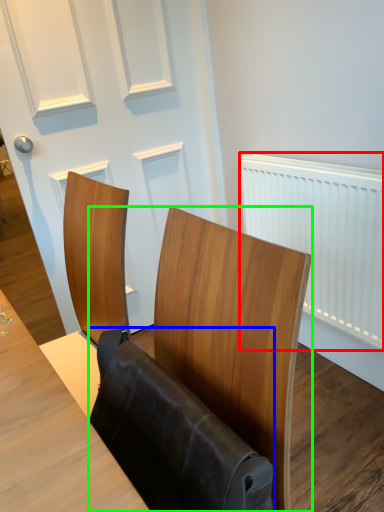
Question: Estimate the real-world distances between objects in this image. Which object is farther from radiator (highlighted by a red box), folding chair (highlighted by a blue box) or furniture (highlighted by a green box)?

Choices:
 (A) folding chair
 (B) furniture

Answer: (A)